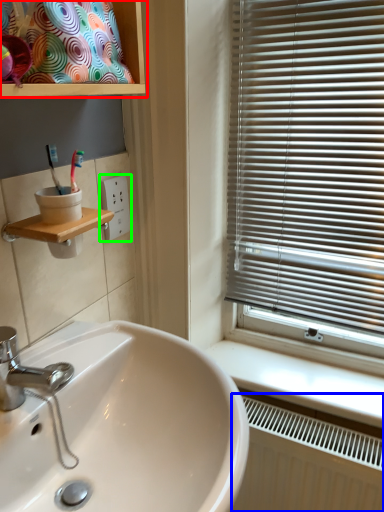
Question: Estimate the real-world distances between objects in this image. Which object is closer to cabinet (highlighted by a red box), radiator (highlighted by a blue box) or electric outlet (highlighted by a green box)?

Choices:
 (A) radiator
 (B) electric outlet

Answer: (B)